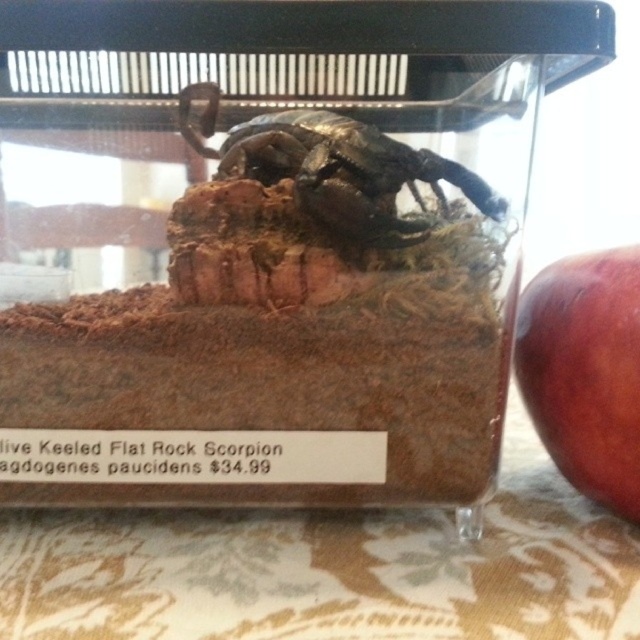
You are a child who wants to grab the red matte apple at right and the metallic scorpion at center from the terrarium. Since the terrarium is glass, you can see both items clearly. Which object should you reach for first if you want to get the one that is closer to the right side of the terrarium?

The red matte apple at right is to the right of the metallic scorpion at center, so it is closer to the right side of the terrarium. You should reach for the red matte apple at right first.

You are a robotic arm that needs to pick up the red matte apple at right and place it in a bowl located near the metallic scorpion at center. The robotic arm has a reach of 8.5 inches. Can the robotic arm reach the apple from the scorpion without moving its base?

The red matte apple at right is 8.79 inches from the metallic scorpion at center. Since the robotic arm has a reach of only 8.5 inches, it cannot reach the apple from the scorpion without moving its base.

You are a scorpion keeper and you need to place a red matte apple at right in the terrarium. Where exactly should you place it?

Place the red matte apple at right at the coordinates point (586, 371).